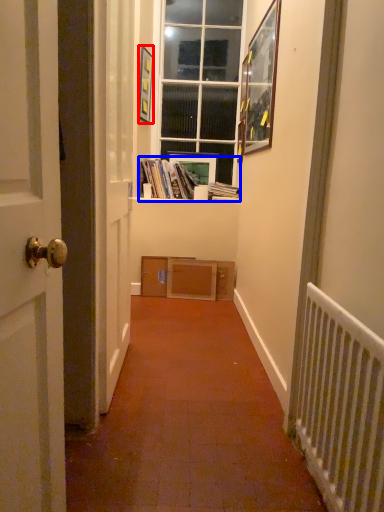
Question: Which of the following is the farthest to the observer, picture frame (highlighted by a red box) or book (highlighted by a blue box)?

Choices:
 (A) picture frame
 (B) book

Answer: (B)